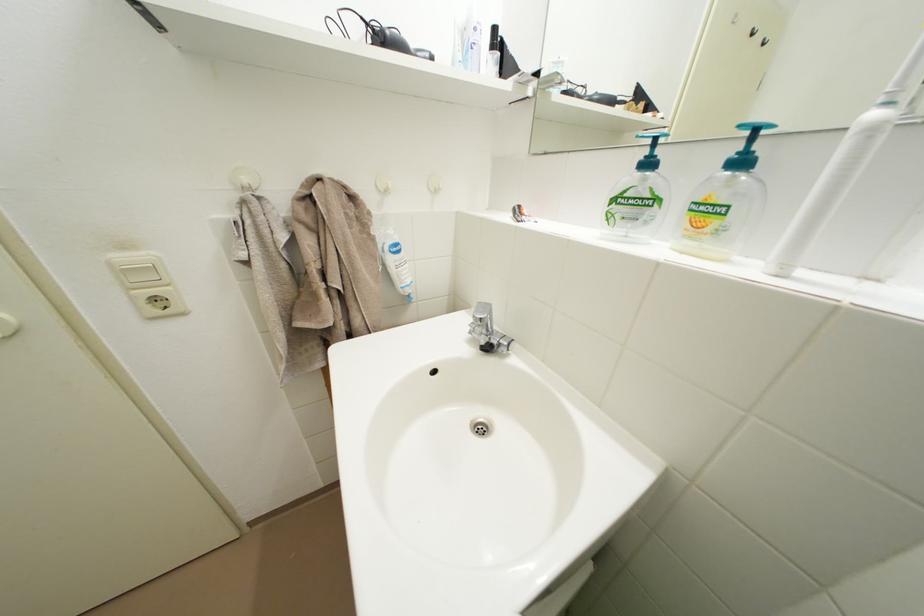
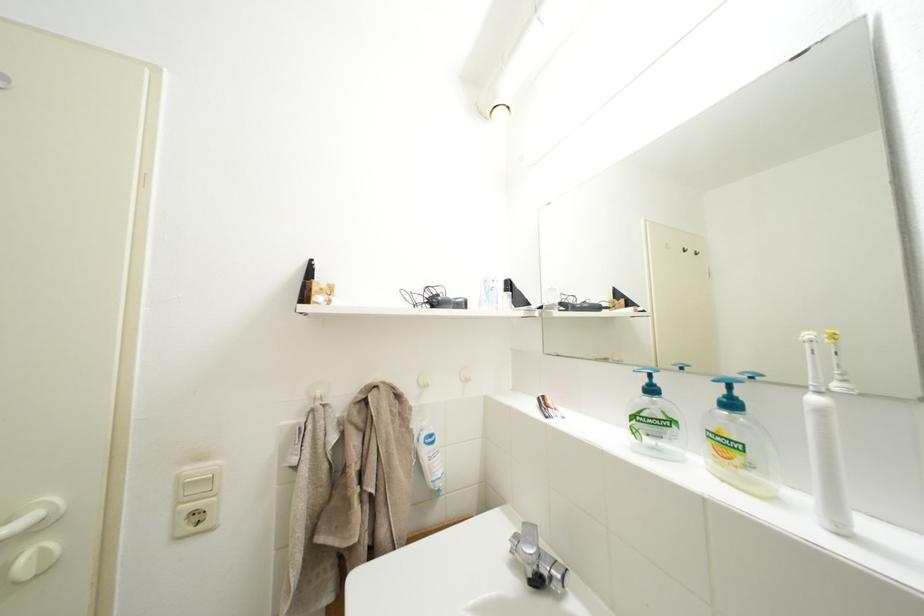
Find the pixel in the second image that matches [140,304] in the first image.

(185, 519)